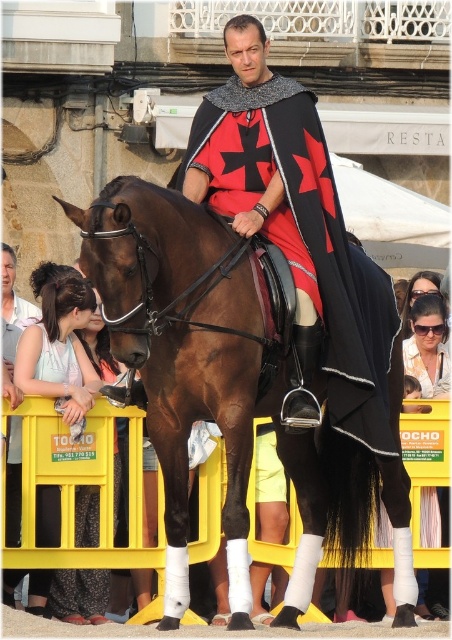
Question: Which point appears closest to the camera in this image?

Choices:
 (A) (116, 246)
 (B) (273, 156)

Answer: (A)

Question: Is brown glossy horse at center to the right of matte black cape at center from the viewer's perspective?

Choices:
 (A) no
 (B) yes

Answer: (B)

Question: From the image, what is the correct spatial relationship of brown glossy horse at center in relation to matte black cape at center?

Choices:
 (A) right
 (B) left

Answer: (A)

Question: Which of the following is the farthest from the observer?

Choices:
 (A) (396, 467)
 (B) (226, 93)

Answer: (B)

Question: Does brown glossy horse at center appear under matte black cape at center?

Choices:
 (A) yes
 (B) no

Answer: (A)